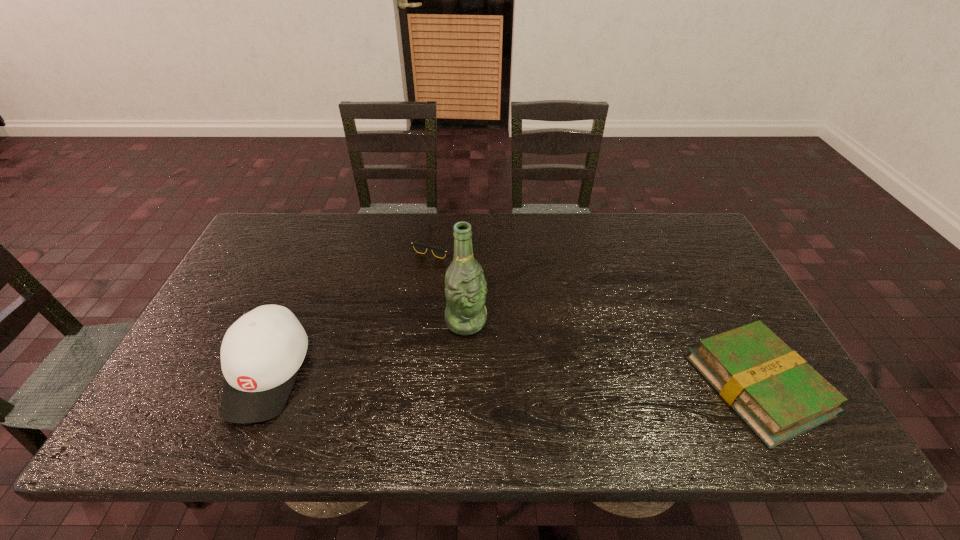
Locate an element on the screen. The image size is (960, 540). baseball cap is located at coordinates (261, 353).

Locate an element on the screen. This screenshot has width=960, height=540. the leftmost object is located at coordinates (261, 353).

This screenshot has width=960, height=540. Identify the location of the rightmost object. (774, 390).

Identify the location of the third tallest object. (774, 390).

Where is `the tallest object`? the tallest object is located at coordinates (465, 286).

Locate an element on the screen. the farthest object is located at coordinates (419, 247).

Where is `sunglasses`? This screenshot has height=540, width=960. sunglasses is located at coordinates (419, 247).

Locate an element on the screen. free space located 0.050m on the left of the book is located at coordinates (677, 386).

The width and height of the screenshot is (960, 540). Identify the location of free region located 0.090m on the surface of the beer bottle. (498, 358).

The height and width of the screenshot is (540, 960). In order to click on vacant area situated on the surface of the beer bottle in this screenshot , I will do `click(493, 353)`.